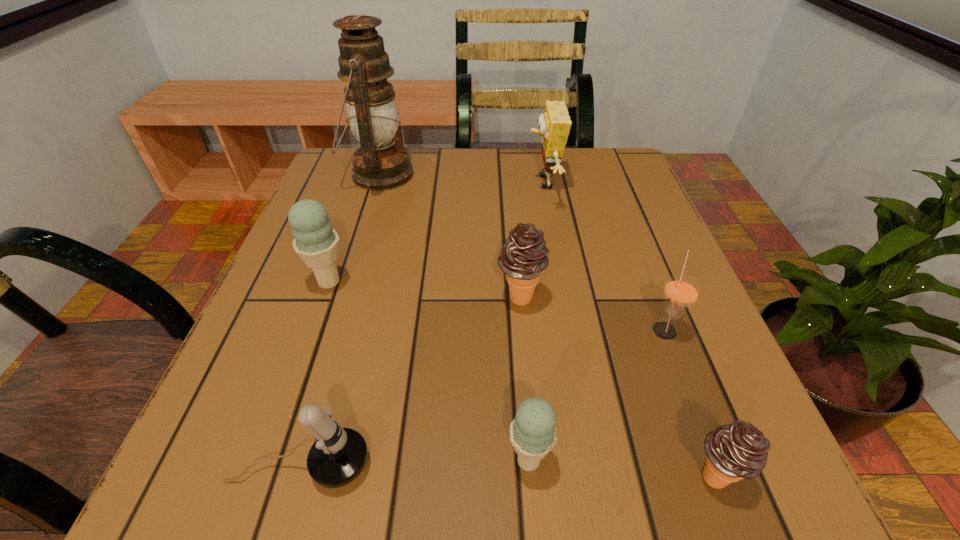
This screenshot has height=540, width=960. Find the location of `object at the far left corner`. object at the far left corner is located at coordinates (380, 164).

Locate an element on the screen. This screenshot has height=540, width=960. object situated at the near left corner is located at coordinates (337, 457).

You are a GUI agent. You are given a task and a screenshot of the screen. Output one action in this format:
    pyautogui.click(x=<x>, y=<y>)
    Task: Click on the object that is at the near right corner
    
    Given the screenshot: What is the action you would take?
    pyautogui.click(x=736, y=451)

I want to click on free space at the far edge of the desktop, so click(558, 184).

This screenshot has height=540, width=960. In the image, there is a desktop. What are the coordinates of `vacant space at the left edge` in the screenshot? It's located at (274, 350).

This screenshot has height=540, width=960. Identify the location of free space at the far left corner. coord(346,173).

Find the location of a particular element. This screenshot has height=540, width=960. free space at the near left corner of the desktop is located at coordinates (299, 512).

Find the location of `free region at the far right corner`. free region at the far right corner is located at coordinates (598, 152).

In order to click on unoccupied position between the rightmost icecream and the right blue ice cream in this screenshot , I will do `click(621, 468)`.

I want to click on vacant space that is in between the right blue ice cream and the rightmost icecream, so click(x=621, y=468).